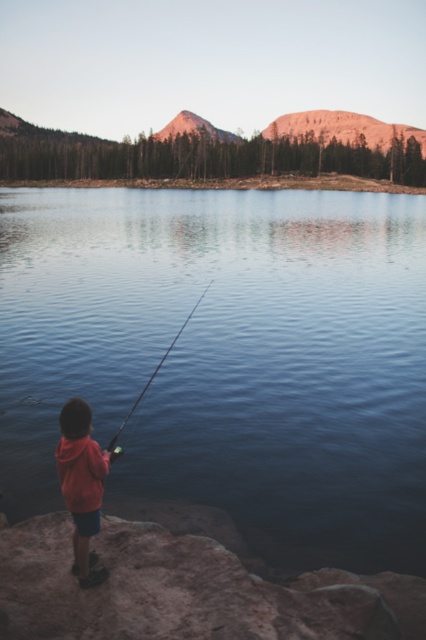
Question: Which point appears closest to the camera in this image?

Choices:
 (A) (83, 458)
 (B) (149, 384)
 (C) (385, 188)

Answer: (A)

Question: Which of the following is the farthest from the observer?

Choices:
 (A) smooth black rod at center
 (B) clear water at center

Answer: (B)

Question: Does clear water at center appear over smooth sand shore at center?

Choices:
 (A) no
 (B) yes

Answer: (A)

Question: Is clear water at center below red hoodie at lower left?

Choices:
 (A) yes
 (B) no

Answer: (B)

Question: Which of the following is the closest to the observer?

Choices:
 (A) (373, 253)
 (B) (83, 496)
 (C) (163, 358)
 (D) (354, 186)

Answer: (B)

Question: Does clear water at center come in front of smooth sand shore at center?

Choices:
 (A) no
 (B) yes

Answer: (B)